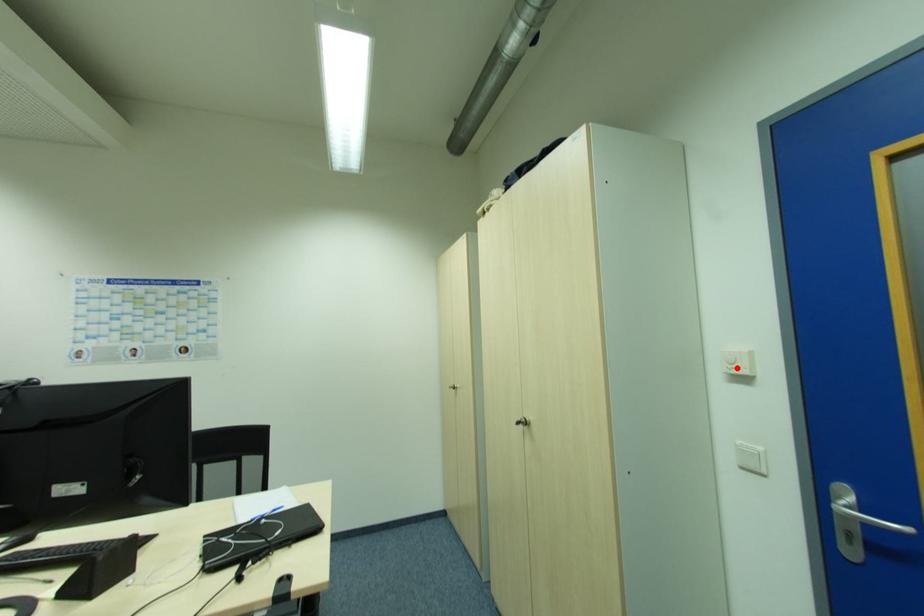
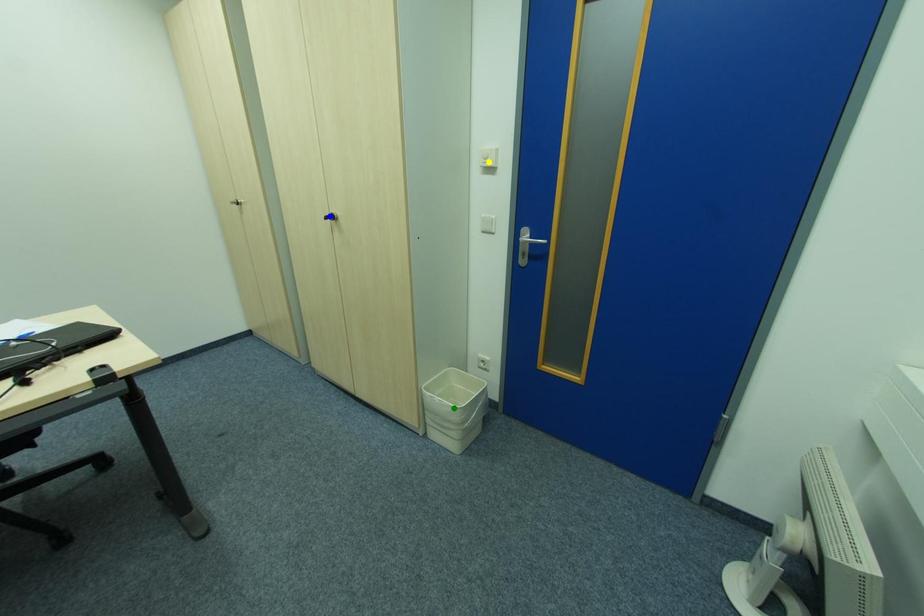
Question: I am providing you with two images of the same scene from different viewpoints. A red point is marked on the first image. You are given multiple points on the second image. Which spot in image 2 lines up with the point in image 1?

Choices:
 (A) yellow point
 (B) blue point
 (C) green point

Answer: (A)